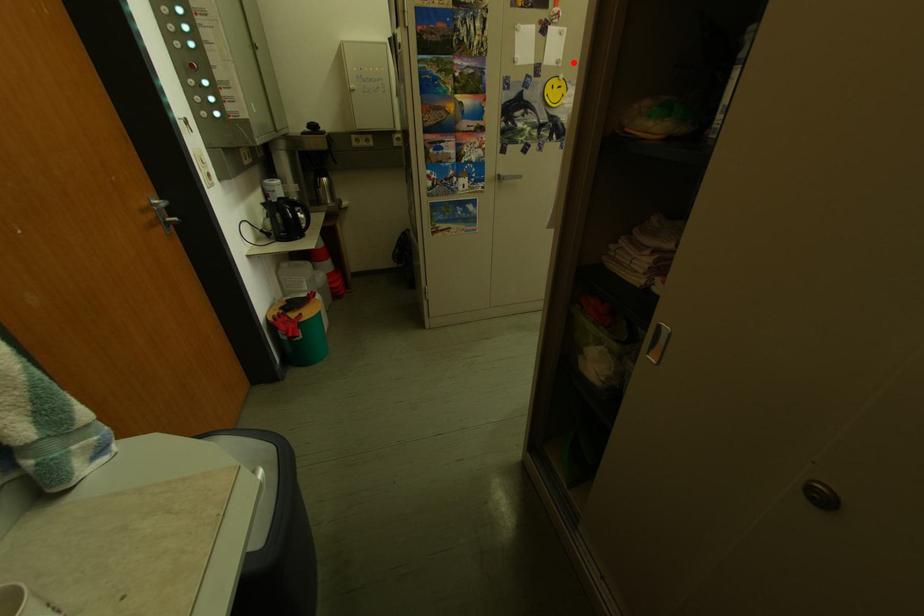
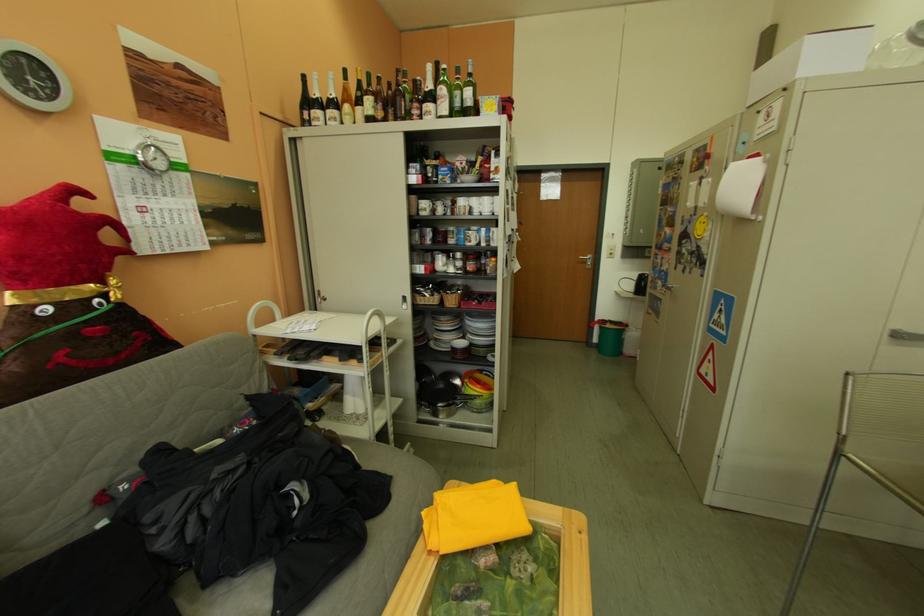
Find the pixel in the second image that matches the highlighted location in the first image.

(720, 204)